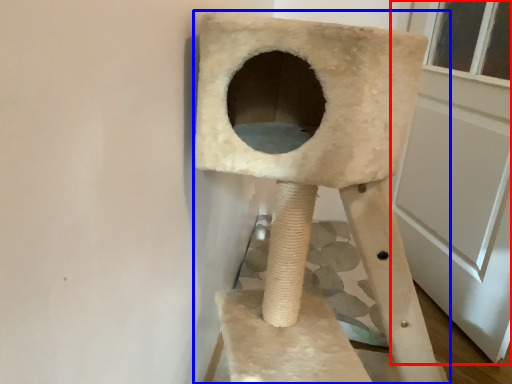
Question: Which object is further to the camera taking this photo, screen door (highlighted by a red box) or furniture (highlighted by a blue box)?

Choices:
 (A) screen door
 (B) furniture

Answer: (A)